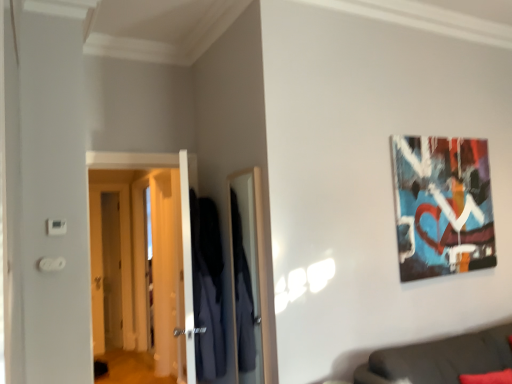
Question: Considering the positions of abstract painting at upper right and dark blue fabric robe at center in the image, is abstract painting at upper right wider or thinner than dark blue fabric robe at center?

Choices:
 (A) wide
 (B) thin

Answer: (B)

Question: From their relative heights in the image, would you say abstract painting at upper right is taller or shorter than dark blue fabric robe at center?

Choices:
 (A) tall
 (B) short

Answer: (B)

Question: Based on their relative distances, which object is nearer to the dark gray fabric couch at lower right?

Choices:
 (A) white glossy door at left, which appears as the 2th door when viewed from the left
 (B) abstract painting at upper right
 (C) dark blue fabric robe at center
 (D) wooden door at left, the 2th door viewed from the front

Answer: (B)

Question: Which object is the closest to the wooden door at left, which is the first door from left to right?

Choices:
 (A) abstract painting at upper right
 (B) dark gray fabric couch at lower right
 (C) dark blue fabric robe at center
 (D) white glossy door at left, which appears as the second door when viewed from the back

Answer: (D)